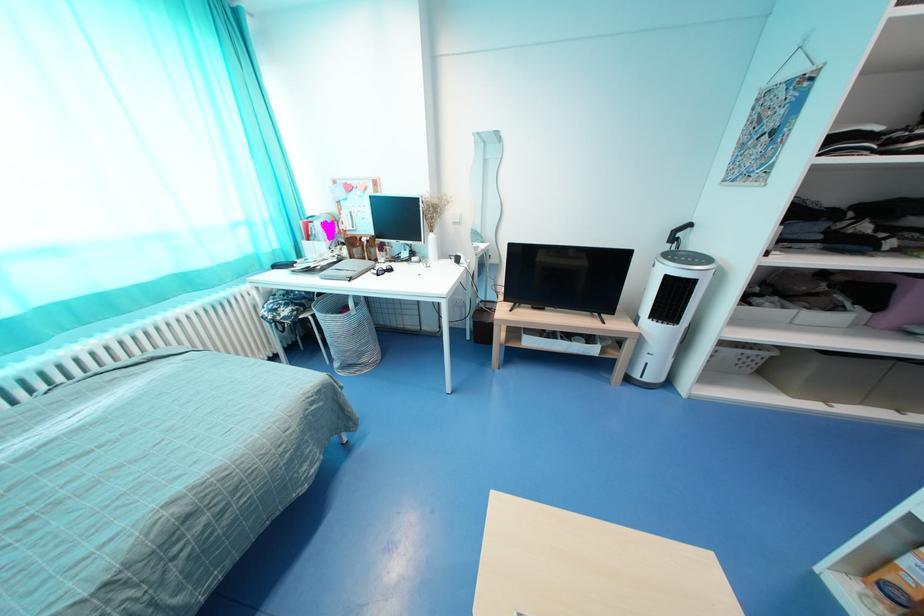
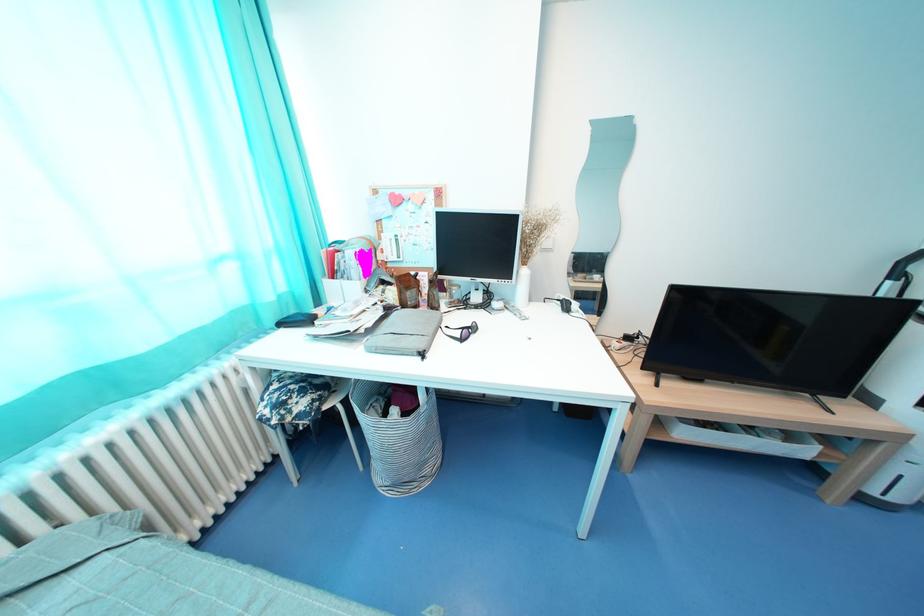
Question: How did the camera likely rotate?

Choices:
 (A) Left
 (B) Right
 (C) Up
 (D) Down

Answer: (C)